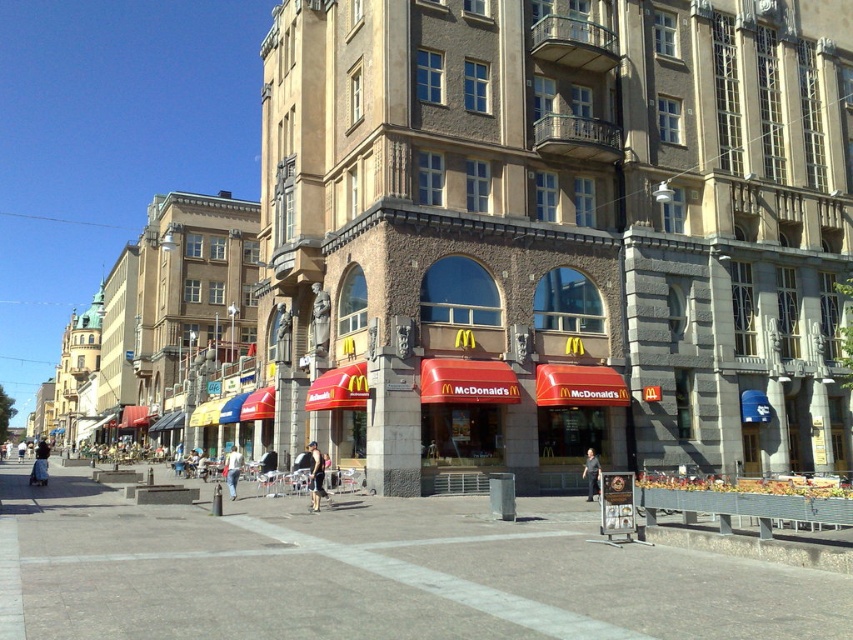
Based on the photo, you are a photographer trying to capture both the black fabric shorts at center and the dark blue jeans at center in a single frame. Since you want to ensure both are clearly visible, which clothing item should you focus on first to account for their size difference?

The black fabric shorts at center is taller than the dark blue jeans at center, so you should focus on the black fabric shorts at center first to ensure its details are sharp before adjusting for the smaller dark blue jeans at center.

Consider the image. You are a delivery person standing at the entrance of the McDonalds with a package. You need to deliver it to the person wearing denim shorts at center and dark blue jeans at center. However, you can only carry the package for 20 meters before needing to rest. Can you reach both recipients without dropping the package?

The denim shorts at center is 22.51 meters away from dark blue jeans at center. Since the distance between them exceeds your 20 meter carrying limit, you cannot deliver to both without resting.